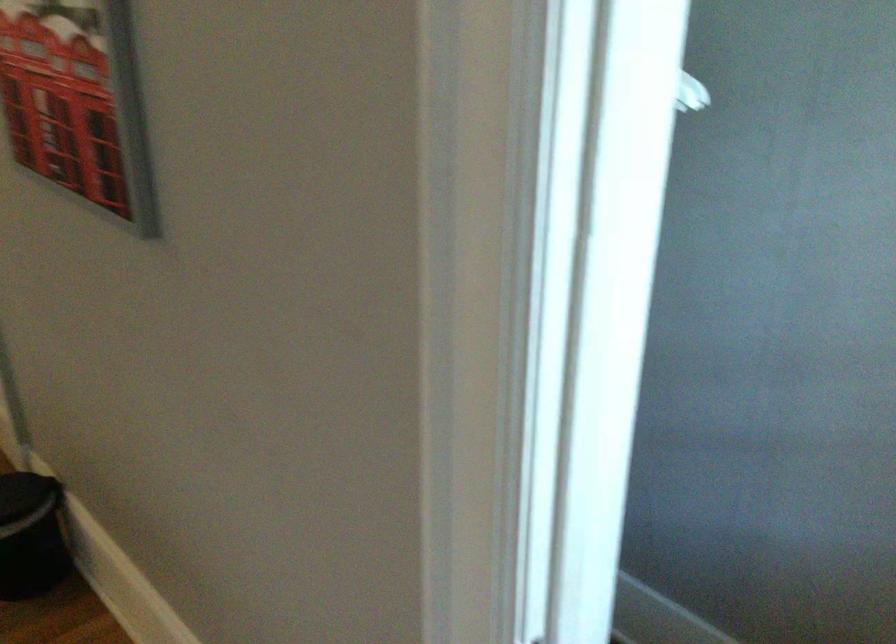
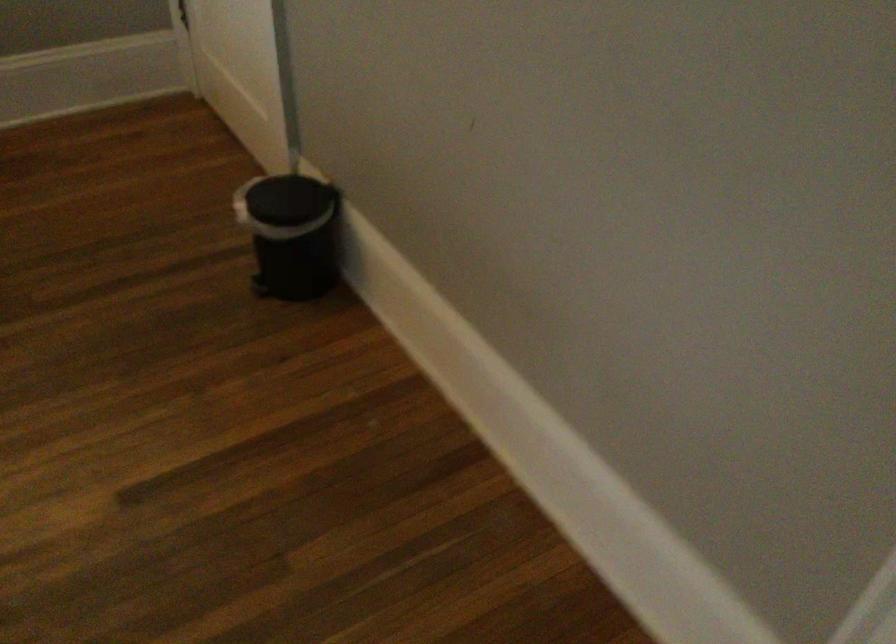
Question: The first image is from the beginning of the video and the second image is from the end. How did the camera likely rotate when shooting the video?

Choices:
 (A) Left
 (B) Right
 (C) Up
 (D) Down

Answer: (D)